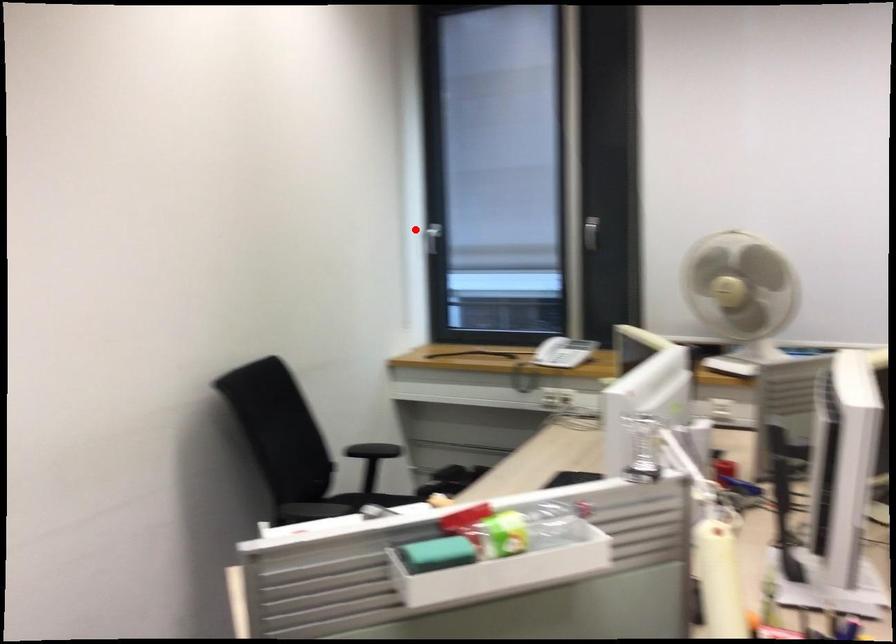
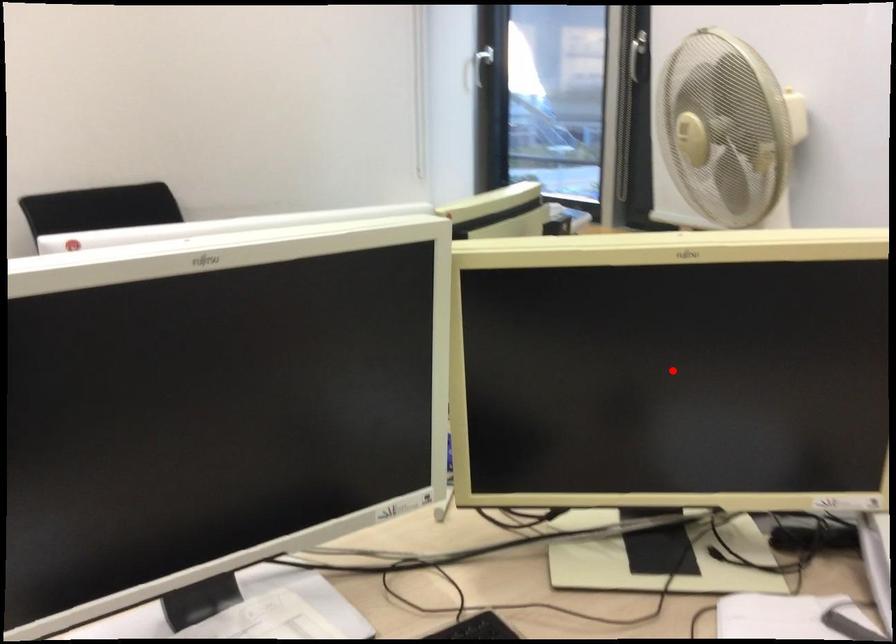
I am providing you with two images of the same scene from different viewpoints. A red point is marked on the first image and another point is marked on the second image. Does the point marked in image1 correspond to the same location as the one in image2?

No